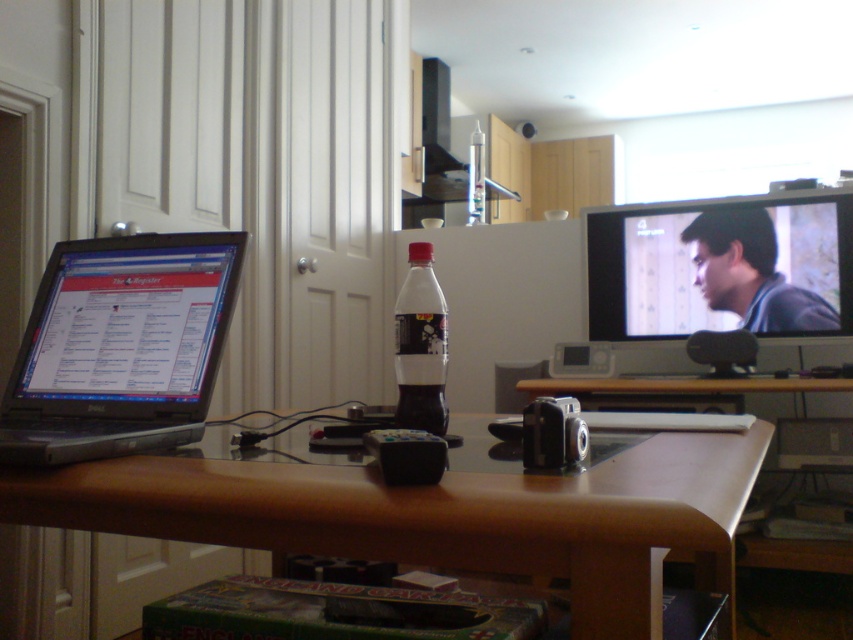
You are a person with a height of 6 feet. You are standing in the scene and want to reach the matte black laptop at left to close the browser tab. Considering your height and the distance between you and the laptop, can you comfortably reach it without needing to stretch too much?

The distance between you and the matte black laptop at left is 28.66 inches. Since the average comfortable reaching distance for someone 6 feet tall is around 28 to 30 inches, you can comfortably reach the matte black laptop at left without stretching too much.